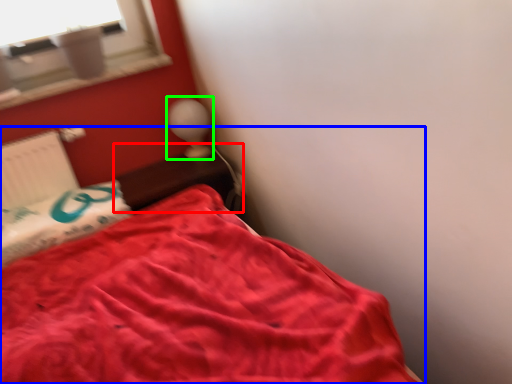
Question: Which object is positioned farthest from table (highlighted by a red box)? Select from bed (highlighted by a blue box) and table lamp (highlighted by a green box).

Choices:
 (A) bed
 (B) table lamp

Answer: (A)